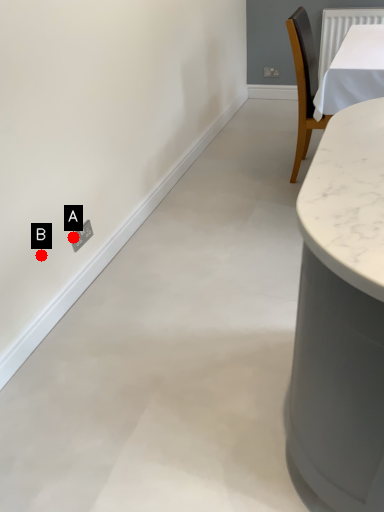
Question: Two points are circled on the image, labeled by A and B beside each circle. Which point is closer to the camera?

Choices:
 (A) A is closer
 (B) B is closer

Answer: (B)